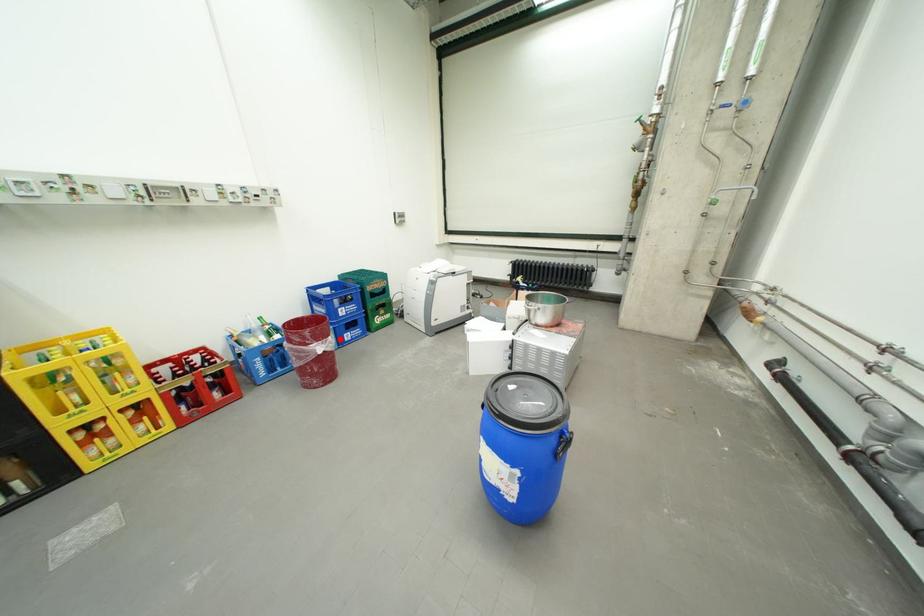
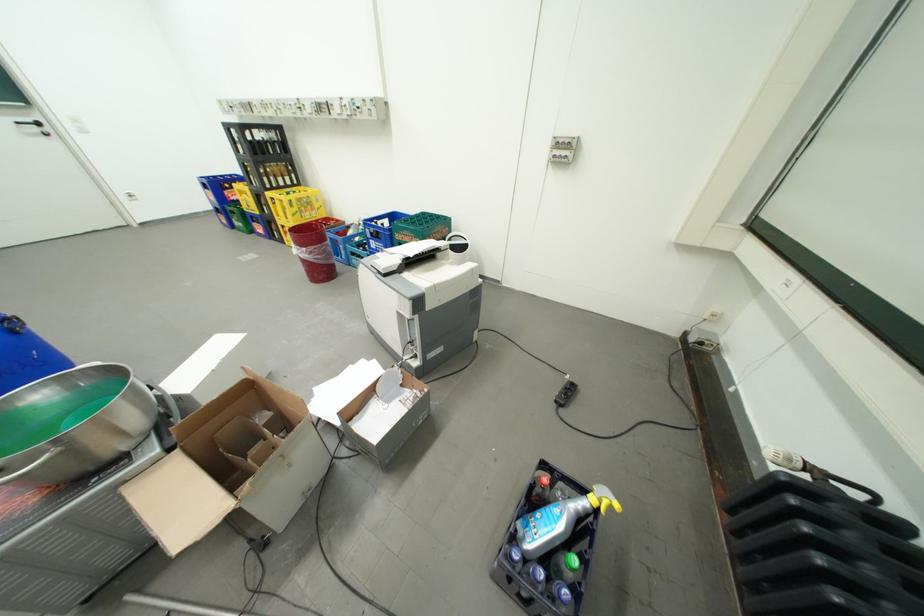
Question: I am providing you with two images of the same scene from different viewpoints. Image1 has a red point marked. In image2, the corresponding 3D location appears at what relative position? Reply with the corresponding letter.

Choices:
 (A) Closer
 (B) Farther

Answer: (B)